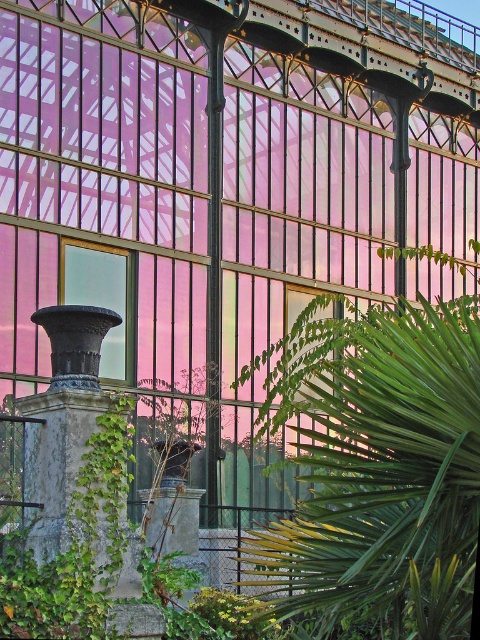
You are a gardener who wants to place a new plant pot on the transparent glass window at center. However, the matte black vase at left is currently blocking the area. Can you move the vase to make space?

The matte black vase at left is located below the transparent glass window at center, so moving it upward would clear the space for the plant pot.

You are standing in the greenhouse and want to water the dark gray stone column at lower left. However, there is a green leafy palm at center in the way. Can you reach the column without moving the palm?

The green leafy palm at center is positioned over dark gray stone column at lower left, so you cannot reach the column without moving the palm.